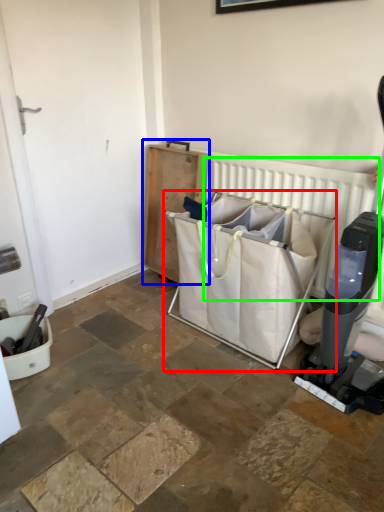
Question: Which object is the closest to the baby carriage (highlighted by a red box)? Choose among these: furniture (highlighted by a blue box) or radiator (highlighted by a green box).

Choices:
 (A) furniture
 (B) radiator

Answer: (B)